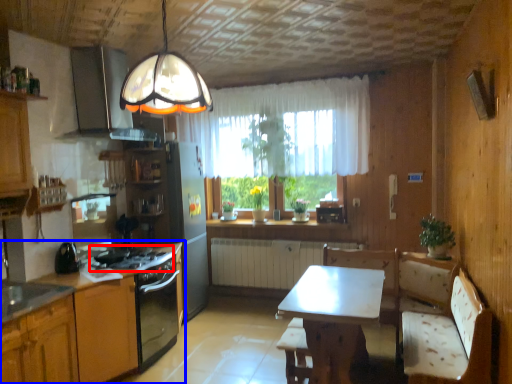
Question: Which object is further to the camera taking this photo, gas stove (highlighted by a red box) or cabinetry (highlighted by a blue box)?

Choices:
 (A) gas stove
 (B) cabinetry

Answer: (A)